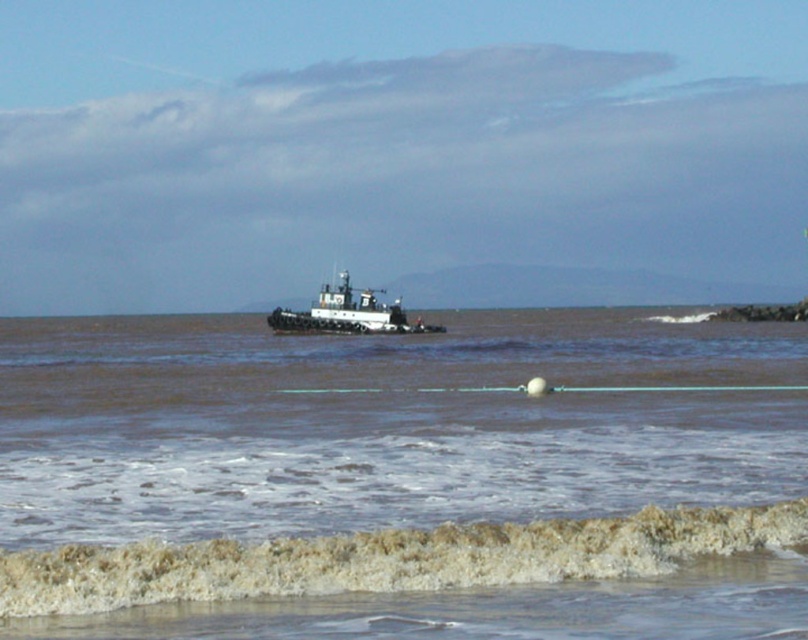
Question: Which of the following is the farthest from the observer?

Choices:
 (A) white matte tugboat at center
 (B) frothy white foam at lower center

Answer: (A)

Question: Which object appears farthest from the camera in this image?

Choices:
 (A) white matte tugboat at center
 (B) brown matte water at center

Answer: (A)

Question: Does frothy white foam at lower center have a lesser width compared to white matte tugboat at center?

Choices:
 (A) no
 (B) yes

Answer: (B)

Question: Estimate the real-world distances between objects in this image. Which object is farther from the white matte tugboat at center?

Choices:
 (A) brown matte water at center
 (B) frothy white foam at lower center

Answer: (B)

Question: Does frothy white foam at lower center have a larger size compared to white matte tugboat at center?

Choices:
 (A) yes
 (B) no

Answer: (B)

Question: Is brown matte water at center below white matte tugboat at center?

Choices:
 (A) yes
 (B) no

Answer: (A)